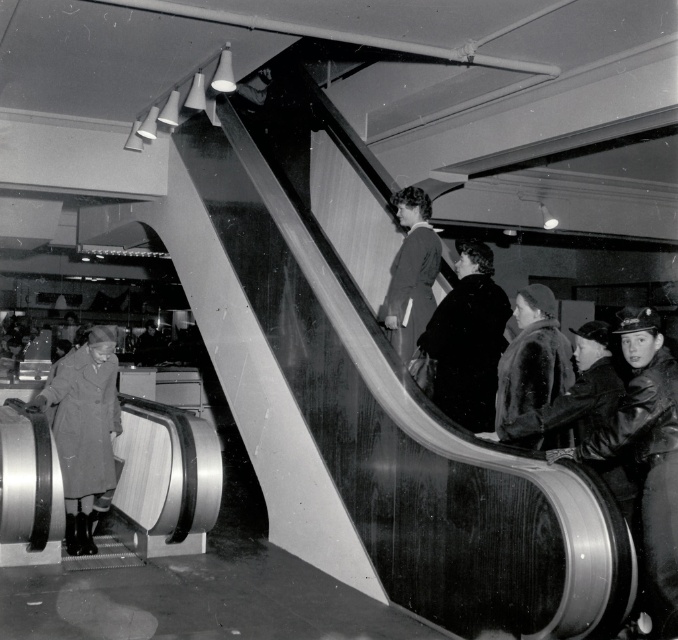
Does point (47, 404) come in front of point (431, 332)?

No, it is not.

Is point (68, 531) farther from viewer compared to point (422, 332)?

Yes, it is behind point (422, 332).

Find the location of a particular element. The height and width of the screenshot is (640, 678). coated gray coat at left is located at coordinates (83, 429).

You are a GUI agent. You are given a task and a screenshot of the screen. Output one action in this format:
    pyautogui.click(x=<x>, y=<y>)
    Task: Click on the dark wool coat at center
    
    Given the screenshot: What is the action you would take?
    466,339

Which of these two, dark wool coat at center or velvet brown coat at center, stands taller?

With more height is dark wool coat at center.

Find the location of a particular element. The image size is (678, 640). dark wool coat at center is located at coordinates (466, 339).

This screenshot has height=640, width=678. Identify the location of dark wool coat at center. coord(466,339).

Between leather jacket at right and coated gray coat at left, which one is positioned higher?

leather jacket at right

Is leather jacket at right positioned behind coated gray coat at left?

No, leather jacket at right is closer to the viewer.

Does point (595, 442) lie behind point (66, 381)?

That is False.

Find the location of a particular element. This screenshot has width=678, height=640. leather jacket at right is located at coordinates (647, 454).